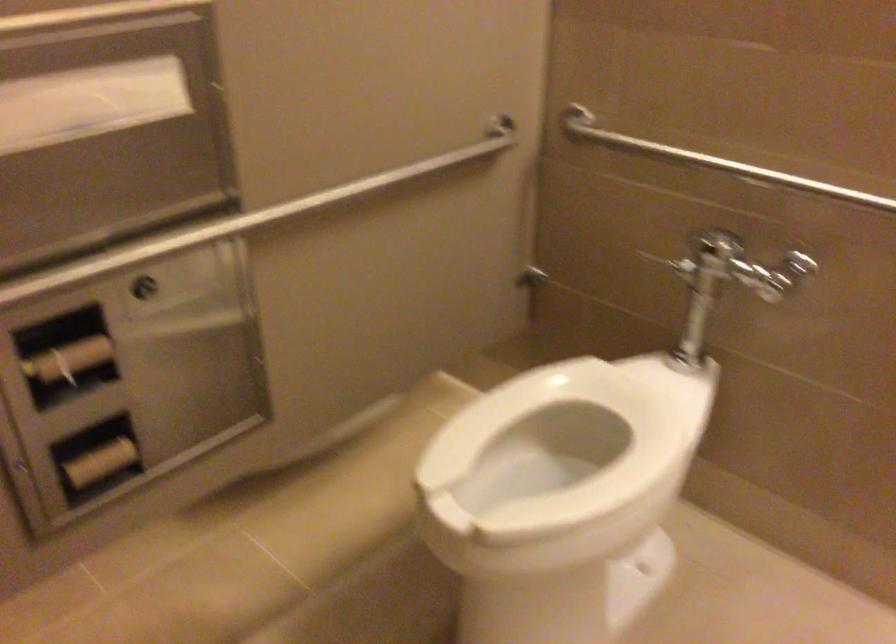
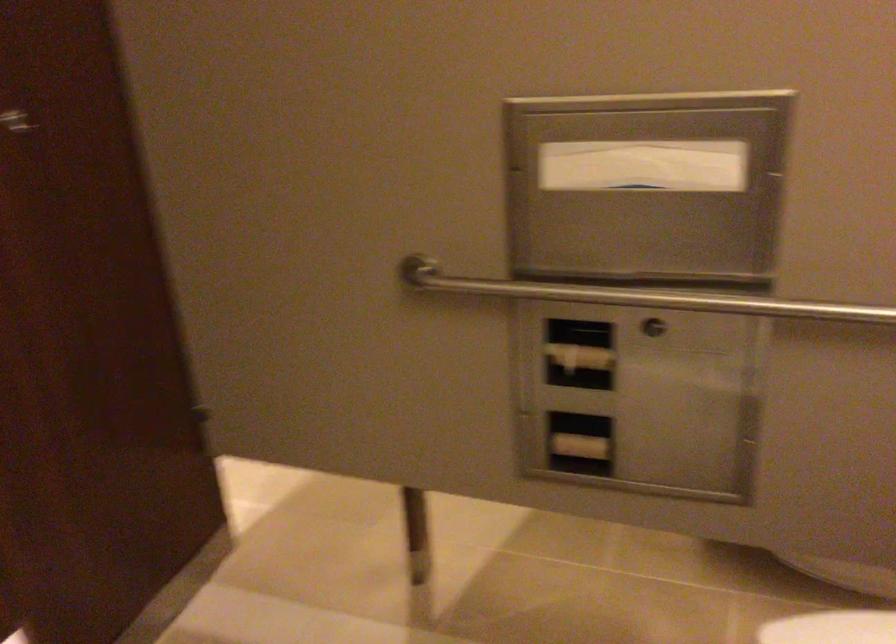
Question: The camera is either moving clockwise (left) or counter-clockwise (right) around the object. The first image is from the beginning of the video and the second image is from the end. Is the camera moving left or right when shooting the video?

Choices:
 (A) Left
 (B) Right

Answer: (B)